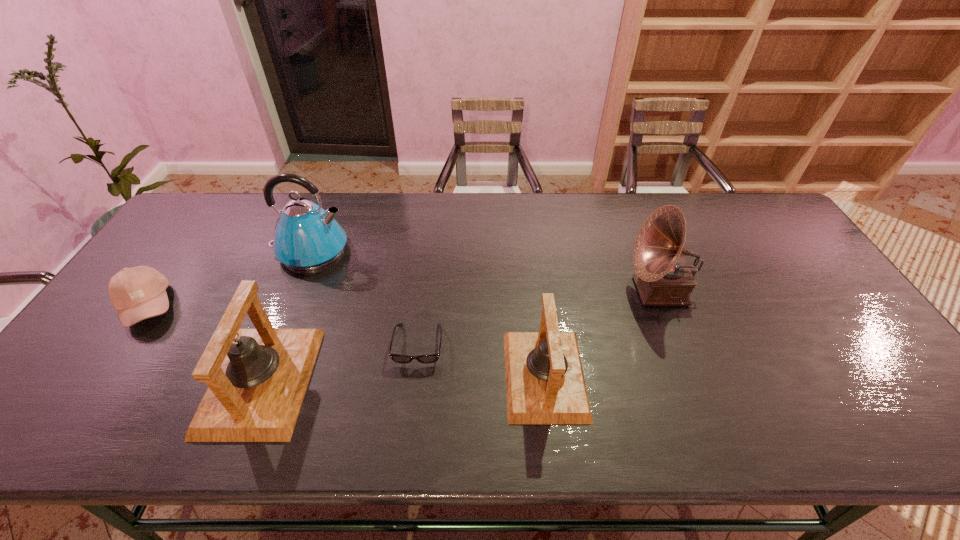
Find the location of a particular element. The width and height of the screenshot is (960, 540). vacant space situated on the right of the third tallest object is located at coordinates 406,381.

Locate an element on the screen. This screenshot has width=960, height=540. free region located 0.090m on the right of the third shortest object is located at coordinates (622, 375).

Where is `free space located 0.260m at the spout of the kettle`? free space located 0.260m at the spout of the kettle is located at coordinates (433, 251).

At what (x,y) coordinates should I click in order to perform the action: click on vacant space situated on the horn of the phonograph record. Please return your answer as a coordinate pair (x, y). The image size is (960, 540). Looking at the image, I should click on (604, 291).

The height and width of the screenshot is (540, 960). Find the location of `vacant area situated 0.070m on the horn of the phonograph record`. vacant area situated 0.070m on the horn of the phonograph record is located at coordinates (604, 291).

Image resolution: width=960 pixels, height=540 pixels. I want to click on vacant space located 0.380m on the horn of the phonograph record, so click(494, 291).

This screenshot has height=540, width=960. I want to click on vacant space located on the front-facing side of the baseball cap, so click(212, 306).

This screenshot has width=960, height=540. What are the coordinates of `vacant region located 0.070m on the lenses of the spectacles` in the screenshot? It's located at (413, 394).

At what (x,y) coordinates should I click in order to perform the action: click on object situated at the far edge. Please return your answer as a coordinate pair (x, y). The image size is (960, 540). Looking at the image, I should click on (307, 237).

Locate an element on the screen. spectacles that is at the near edge is located at coordinates (426, 359).